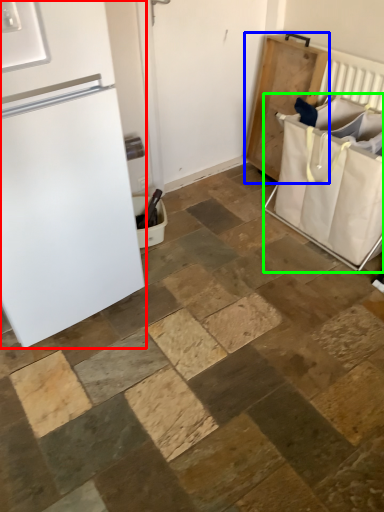
Question: Estimate the real-world distances between objects in this image. Which object is farther from refrigerator (highlighted by a red box), changing table (highlighted by a blue box) or laundry basket (highlighted by a green box)?

Choices:
 (A) changing table
 (B) laundry basket

Answer: (A)